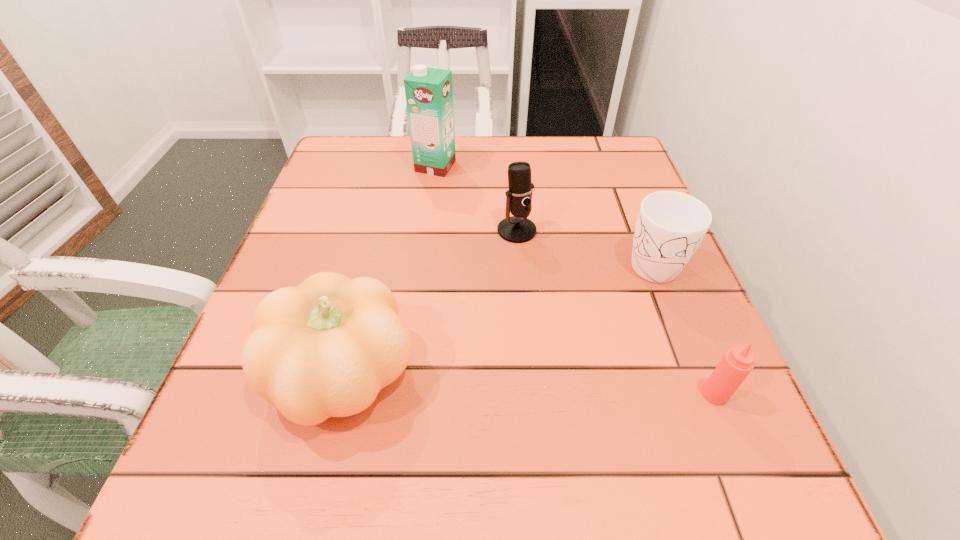
Where is `empty location between the Tabasco sauce and the mug`? empty location between the Tabasco sauce and the mug is located at coordinates (683, 327).

Where is `free space between the third object from left to right and the pumpkin`? This screenshot has width=960, height=540. free space between the third object from left to right and the pumpkin is located at coordinates (431, 302).

Locate which object ranks second in proximity to the mug. Please provide its 2D coordinates. Your answer should be formatted as a tuple, i.e. [(x, y)], where the tuple contains the x and y coordinates of a point satisfying the conditions above.

[(737, 363)]

Where is `the fourth closest object relative to the Tabasco sauce`? This screenshot has height=540, width=960. the fourth closest object relative to the Tabasco sauce is located at coordinates (429, 91).

Where is `vacant region that satisfies the following two spatial constraints: 1. on the front side of the microphone; 2. on the left side of the farthest object`? vacant region that satisfies the following two spatial constraints: 1. on the front side of the microphone; 2. on the left side of the farthest object is located at coordinates (427, 231).

Find the location of a particular element. The height and width of the screenshot is (540, 960). vacant area that satisfies the following two spatial constraints: 1. on the side of the Tabasco sauce with the handle; 2. on the left side of the mug is located at coordinates (704, 394).